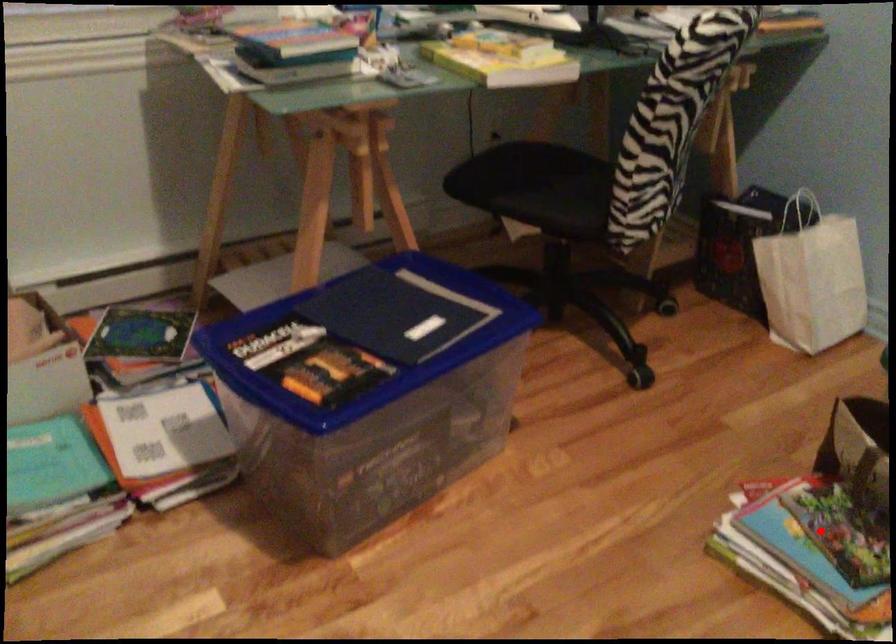
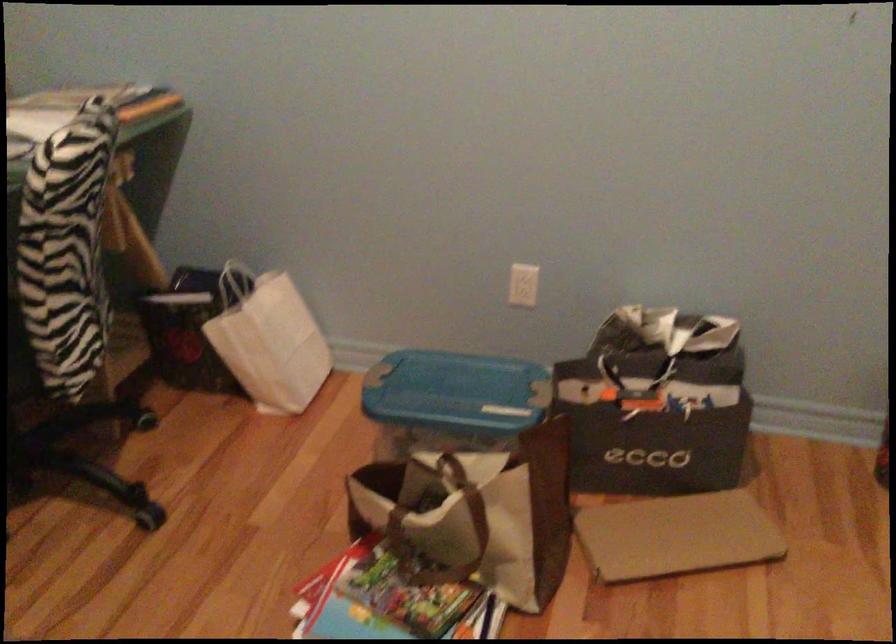
Locate, in the second image, the point that corresponds to the highlighted location in the first image.

(388, 601)